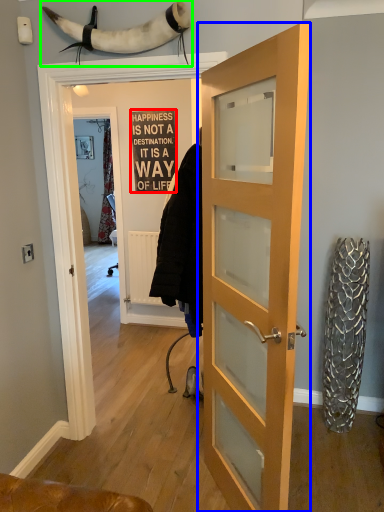
Question: Estimate the real-world distances between objects in this image. Which object is farther from writing (highlighted by a red box), door (highlighted by a blue box) or animal (highlighted by a green box)?

Choices:
 (A) door
 (B) animal

Answer: (B)